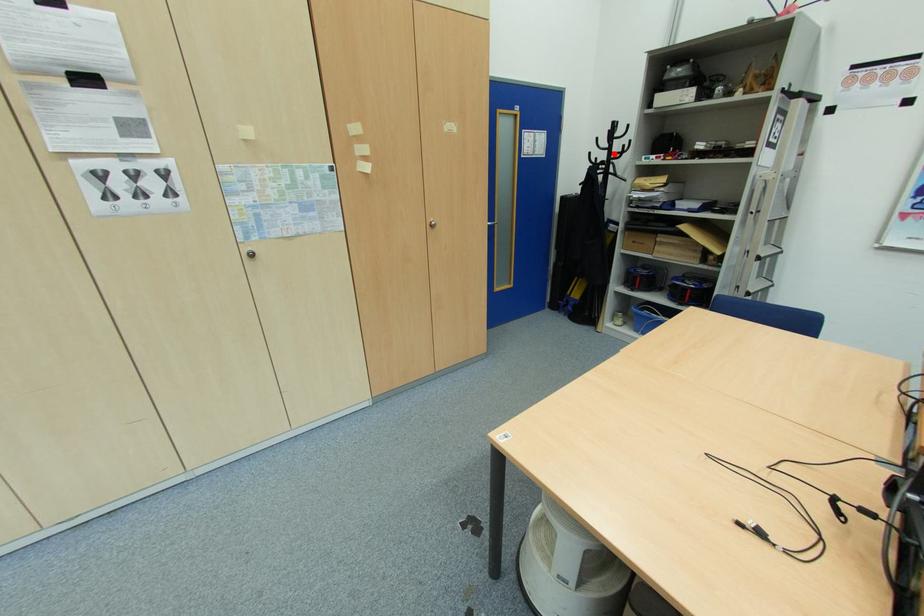
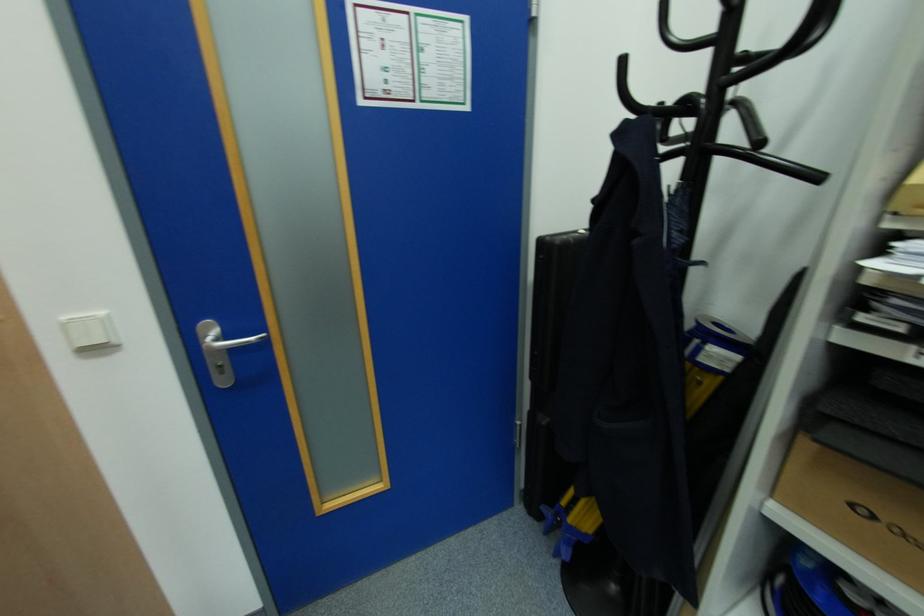
Find the pixel in the second image that matches the highlighted location in the first image.

(726, 61)